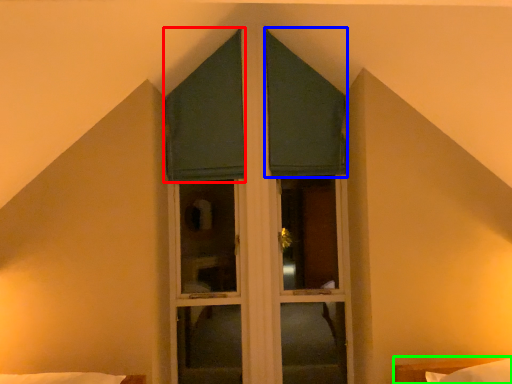
Question: Which is nearer to the curtain (highlighted by a red box)? curtain (highlighted by a blue box) or bed (highlighted by a green box).

Choices:
 (A) curtain
 (B) bed

Answer: (A)